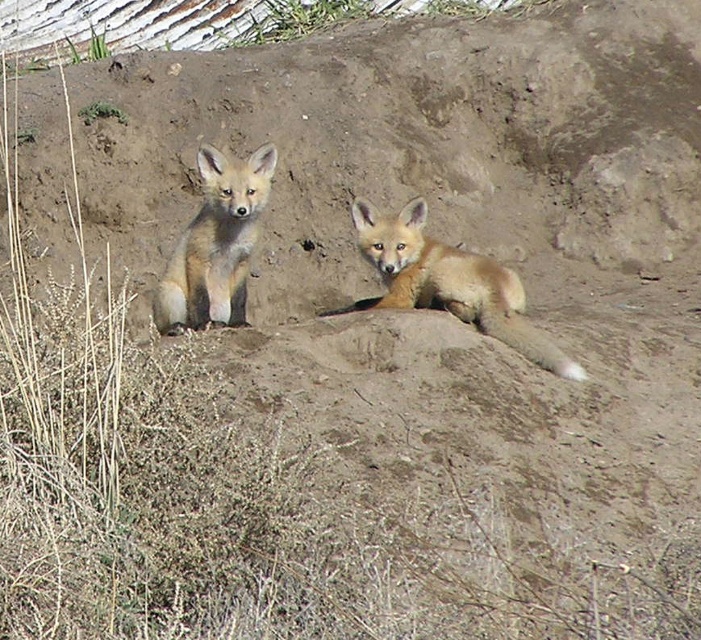
Where is the golden fur fox at center located in the image?

The golden fur fox at center is located at point 0.441 on the x axis and 0.643 on the y axis.

You are a photographer trying to capture both foxes in a single shot. You notice two points marked on your camera screen. The first point is at coordinate point (416, 211) and the second at point (236, 173). Which point is closer to the camera?

Point (236, 173) is closer to the camera because the objects description states that point (416, 211) is behind point (236, 173).

From the picture: You are a wildlife photographer trying to capture a clear photo of the golden fur fox at center and the fuzzy brown fox at left. Since you want both foxes to be in focus, which one should you focus on first to ensure the other is also in focus?

You should focus on the fuzzy brown fox at left first because it is farther away than the golden fur fox at center, ensuring both will be in focus when using depth of field.